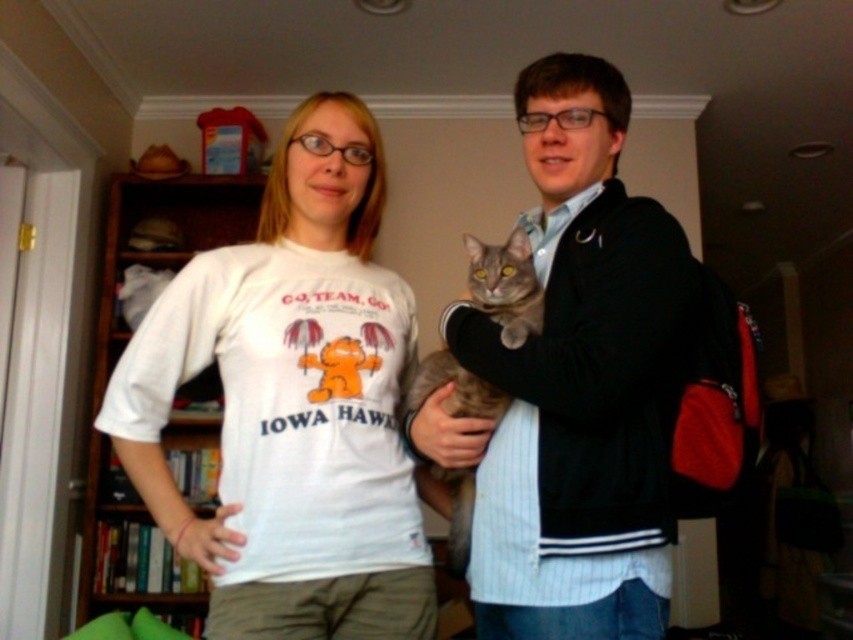
You are standing in the room and want to move from the point closer to you to the point further away. Which path should you take? The points are point (213, 490) and point (485, 394). Please specify the starting and ending points based on their coordinates.

You should start at point (213, 490) and move towards point (485, 394) because point (213, 490) is closer to you and point (485, 394) is further away.

You are standing in the room and want to reach the point at coordinates point [593,492]. If your arm can reach 3 feet, can you touch it without moving?

The point [593,492] is 3.68 feet from the viewer, which is beyond the 3 feet reach of your arm, so you cannot touch it without moving.